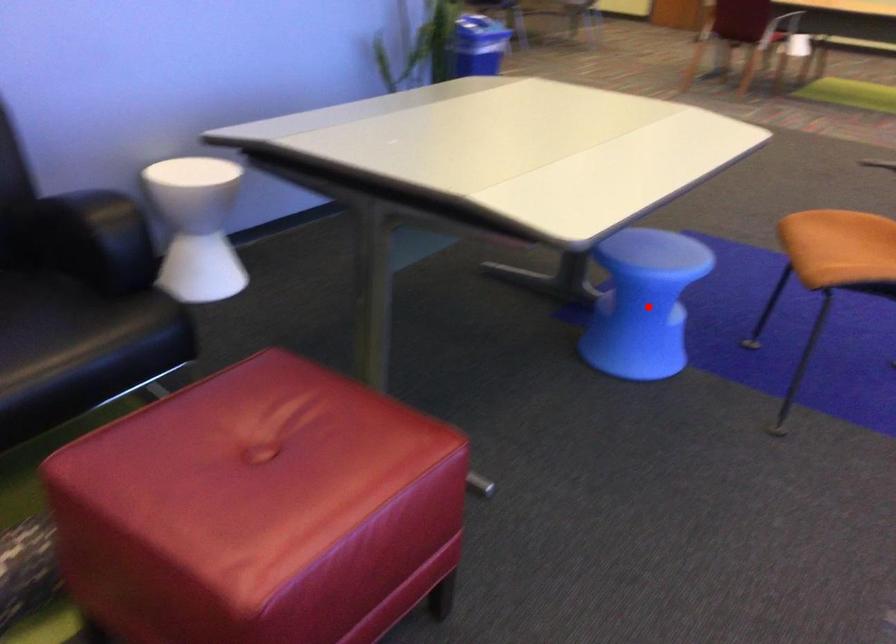
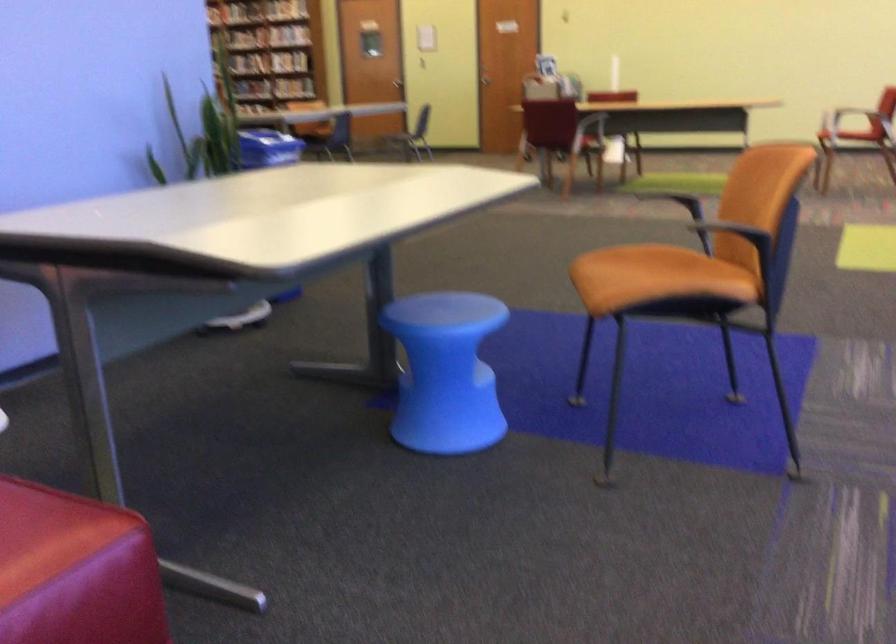
The point at the highlighted location is marked in the first image. Where is the corresponding point in the second image?

(445, 372)